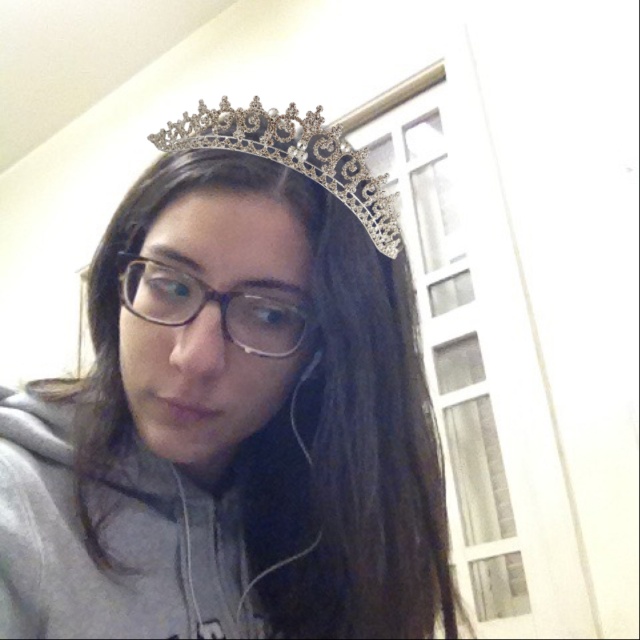
This screenshot has width=640, height=640. Describe the element at coordinates (234, 410) in the screenshot. I see `silver metallic crown at upper center` at that location.

Between point (328, 252) and point (125, 288), which one is positioned in front?

Point (328, 252) is in front.

In order to click on silver metallic crown at upper center in this screenshot , I will do `click(234, 410)`.

Where is `silver metallic crown at upper center`? This screenshot has width=640, height=640. silver metallic crown at upper center is located at coordinates (234, 410).

Can you confirm if silver metallic crown at upper center is smaller than silver metallic tiara at upper center?

No, silver metallic crown at upper center is not smaller than silver metallic tiara at upper center.

Is silver metallic crown at upper center bigger than silver metallic tiara at upper center?

Yes, silver metallic crown at upper center is bigger than silver metallic tiara at upper center.

I want to click on silver metallic crown at upper center, so click(234, 410).

This screenshot has height=640, width=640. Identify the location of silver metallic crown at upper center. coord(234,410).

Is point (170, 125) positioned behind point (307, 324)?

Yes.

Between silver metallic tiara at upper center and transparent plastic glasses at center, which one appears on the right side from the viewer's perspective?

Positioned to the right is silver metallic tiara at upper center.

Where is `silver metallic tiara at upper center`? The image size is (640, 640). silver metallic tiara at upper center is located at coordinates (292, 156).